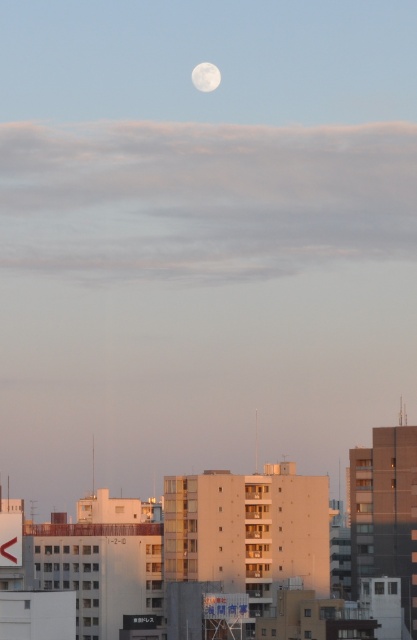
Does beige concrete building at center lie behind white matte moon at upper center?

No, beige concrete building at center is closer to the viewer.

Which is below, beige concrete building at center or white matte moon at upper center?

beige concrete building at center is lower down.

Is point (308, 568) farther from viewer compared to point (205, 68)?

No, it is in front of (205, 68).

Find the location of a particular element. Image resolution: width=417 pixels, height=640 pixels. beige concrete building at center is located at coordinates (248, 531).